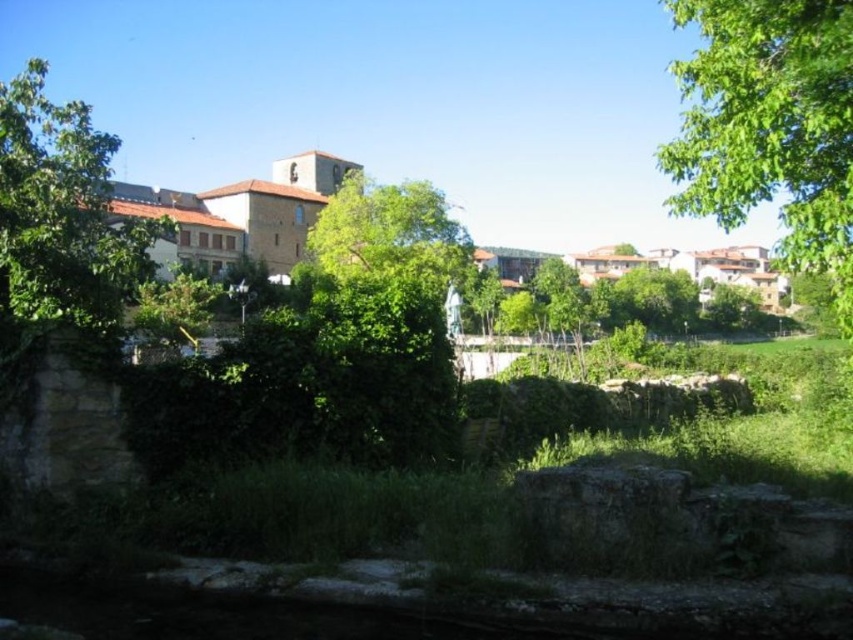
You are standing in the village scene and want to locate the point marked at coordinates (770, 125). Based on the description, where would you find this point in the image?

The point marked at coordinates (770, 125) is located on the green leafy tree at upper right.

You are standing in the village scene looking at the image. Where is the green leafy tree at upper right located in terms of its 2D coordinates?

The green leafy tree at upper right is located at the 2D coordinates of point (770, 125).

You are standing in the village scene and want to reach the point marked as point (737, 138). If your walking speed is 1.5 meters per second, how many seconds will it take you to reach that point?

The point (737, 138) is 13.34 meters away from the viewer. At a speed of 1.5 meters per second, it would take approximately 8.89 seconds to reach it.